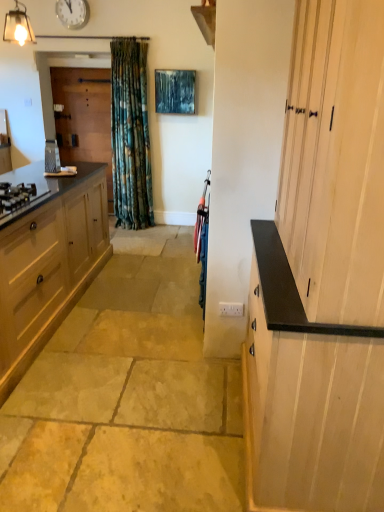
Question: Is matte black gas stove at left spatially inside matte glass light fixture at upper left, or outside of it?

Choices:
 (A) inside
 (B) outside

Answer: (B)

Question: From a real-world perspective, is matte black gas stove at left positioned above or below matte glass light fixture at upper left?

Choices:
 (A) above
 (B) below

Answer: (B)

Question: Estimate the real-world distances between objects in this image. Which object is closer to the matte black gas stove at left?

Choices:
 (A) matte wood cabinet at left, the 1th cabinetry in the left-to-right sequence
 (B) metallic silver grater at left
 (C) matte glass light fixture at upper left
 (D) natural stone floor at center
 (E) white glossy clock at upper center

Answer: (A)

Question: Which object is the closest to the white glossy clock at upper center?

Choices:
 (A) metallic silver grater at left
 (B) natural stone floor at center
 (C) matte black gas stove at left
 (D) matte glass light fixture at upper left
 (E) wooden screen door at left

Answer: (D)